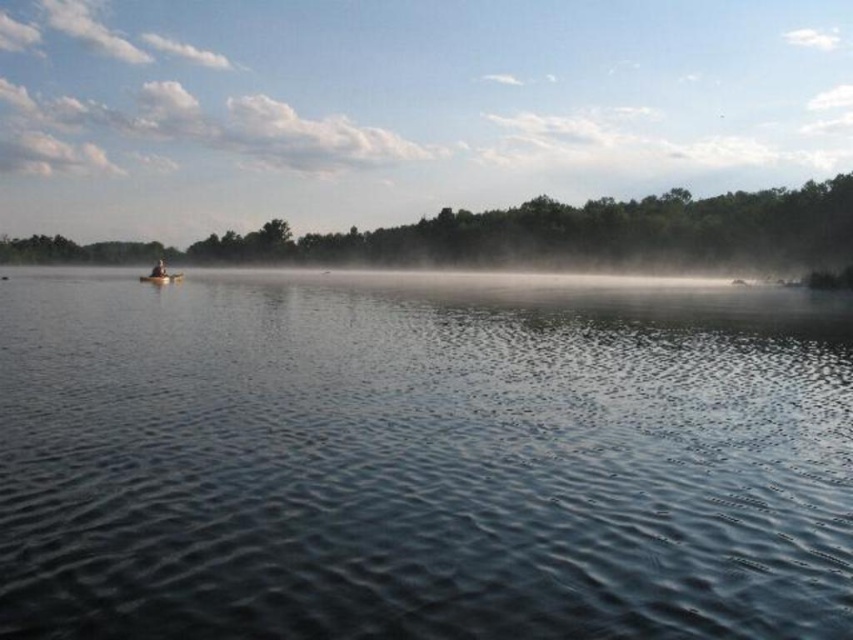
How far apart are smooth wooden canoe at left and black plastic paddle at left?

They are 261.87 meters apart.

Can you confirm if smooth wooden canoe at left is positioned above black plastic paddle at left?

Indeed, smooth wooden canoe at left is positioned over black plastic paddle at left.

Locate an element on the screen. This screenshot has height=640, width=853. smooth wooden canoe at left is located at coordinates (402, 106).

I want to click on smooth wooden canoe at left, so click(402, 106).

Measure the distance between smooth dark water at center and camera.

smooth dark water at center is 6.53 meters from camera.

Based on the photo, between smooth dark water at center and smooth wooden canoe at left, which one appears on the left side from the viewer's perspective?

smooth dark water at center is more to the left.

Between point (746, 362) and point (675, 64), which one is positioned behind?

The point (675, 64) is more distant.

The width and height of the screenshot is (853, 640). What are the coordinates of `smooth dark water at center` in the screenshot? It's located at (422, 458).

Which is below, smooth wooden canoe at left or wooden canoe at center?

wooden canoe at center is lower down.

Who is positioned more to the right, smooth wooden canoe at left or wooden canoe at center?

smooth wooden canoe at left is more to the right.

This screenshot has height=640, width=853. I want to click on smooth wooden canoe at left, so click(402, 106).